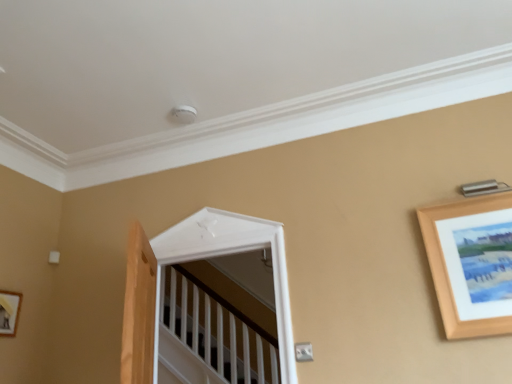
Question: Is wooden picture frame at lower left, which is the first picture frame in back-to-front order, to the left of white glossy door at center from the viewer's perspective?

Choices:
 (A) no
 (B) yes

Answer: (B)

Question: Can you confirm if wooden picture frame at lower left, positioned as the 2th picture frame in front-to-back order, is wider than white glossy door at center?

Choices:
 (A) yes
 (B) no

Answer: (B)

Question: Does wooden picture frame at lower left, which is the first picture frame in back-to-front order, come behind white glossy door at center?

Choices:
 (A) no
 (B) yes

Answer: (B)

Question: Is wooden picture frame at lower left, which is the first picture frame in back-to-front order, closer to camera compared to white glossy door at center?

Choices:
 (A) yes
 (B) no

Answer: (B)

Question: From a real-world perspective, is wooden picture frame at lower left, acting as the 1th picture frame starting from the left, beneath white glossy door at center?

Choices:
 (A) no
 (B) yes

Answer: (B)

Question: Considering the relative sizes of wooden picture frame at lower left, which is the first picture frame in back-to-front order, and white glossy door at center in the image provided, is wooden picture frame at lower left, which is the first picture frame in back-to-front order, shorter than white glossy door at center?

Choices:
 (A) no
 (B) yes

Answer: (B)

Question: Is wooden picture frame at lower left, which is the first picture frame in back-to-front order, not close to wooden picture frame at upper right, which ranks as the second picture frame in left-to-right order?

Choices:
 (A) no
 (B) yes

Answer: (B)

Question: Is the depth of wooden picture frame at lower left, positioned as the 2th picture frame in front-to-back order, less than that of wooden picture frame at upper right, which ranks as the second picture frame in left-to-right order?

Choices:
 (A) no
 (B) yes

Answer: (A)

Question: Can wooden picture frame at upper right, marked as the second picture frame in a back-to-front arrangement, be found inside wooden picture frame at lower left, which appears as the 2th picture frame when viewed from the right?

Choices:
 (A) no
 (B) yes

Answer: (A)

Question: From the image's perspective, is wooden picture frame at lower left, positioned as the 2th picture frame in front-to-back order, beneath wooden picture frame at upper right, which ranks as the second picture frame in left-to-right order?

Choices:
 (A) yes
 (B) no

Answer: (A)

Question: Can you confirm if wooden picture frame at lower left, which appears as the 2th picture frame when viewed from the right, is wider than wooden picture frame at upper right, marked as the second picture frame in a back-to-front arrangement?

Choices:
 (A) yes
 (B) no

Answer: (B)

Question: Does wooden picture frame at lower left, which appears as the 2th picture frame when viewed from the right, come behind wooden picture frame at upper right, arranged as the first picture frame when viewed from the right?

Choices:
 (A) no
 (B) yes

Answer: (B)

Question: Is the depth of white glossy door at center less than that of wooden picture frame at lower left, which appears as the 2th picture frame when viewed from the right?

Choices:
 (A) yes
 (B) no

Answer: (A)